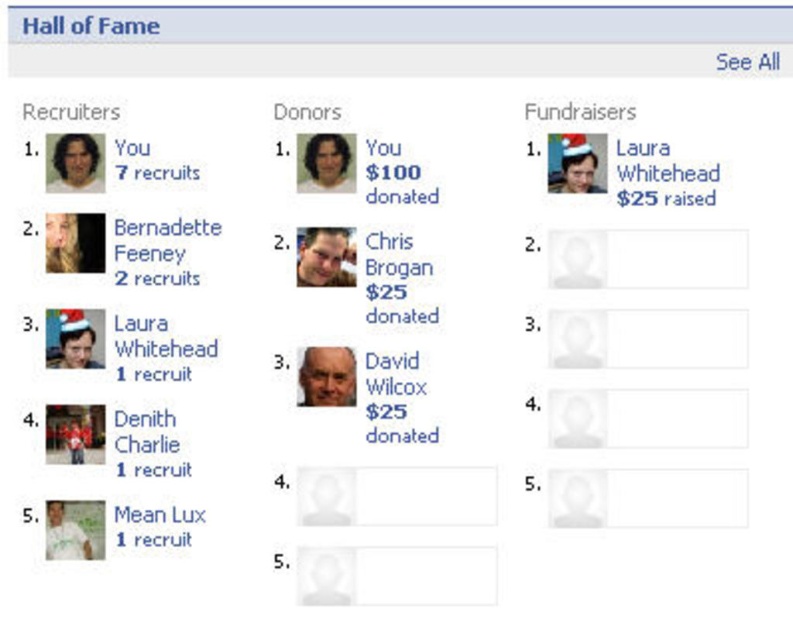
Question: Estimate the real-world distances between objects in this image. Which object is farther from the matte skin face at center-left?

Choices:
 (A) matte black face at upper left
 (B) matte plastic face at center

Answer: (B)

Question: Is blue text hall of fame at upper center thinner than matte black face at center?

Choices:
 (A) no
 (B) yes

Answer: (A)

Question: Which point is farther to the camera?

Choices:
 (A) (48, 508)
 (B) (52, 236)
 (C) (320, 230)

Answer: (C)

Question: Which of these objects is positioned farthest from the matte black face at lower left?

Choices:
 (A) matte plastic face at upper center
 (B) matte skin face at center-left
 (C) matte black face at upper left

Answer: (A)

Question: Does matte black face at center come behind matte plastic face at upper center?

Choices:
 (A) no
 (B) yes

Answer: (A)

Question: Does blue text hall of fame at upper center appear under matte black face at upper left?

Choices:
 (A) yes
 (B) no

Answer: (B)